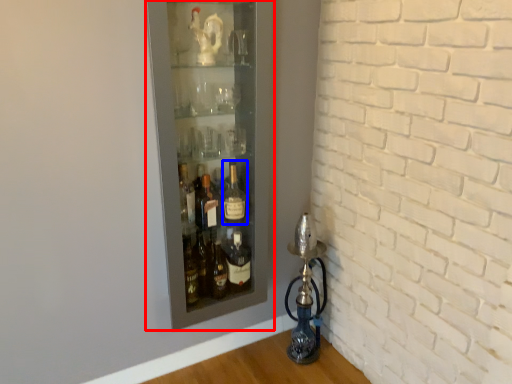
Question: Which of the following is the closest to the observer, shelf (highlighted by a red box) or bottle (highlighted by a blue box)?

Choices:
 (A) shelf
 (B) bottle

Answer: (A)